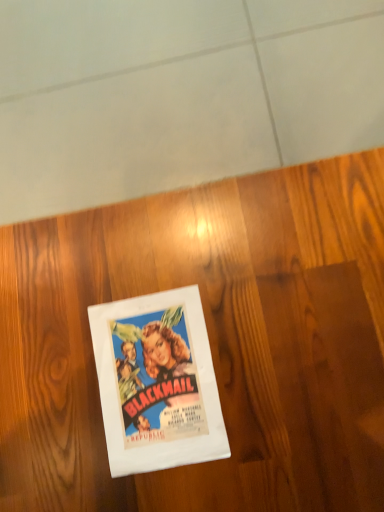
You are a GUI agent. You are given a task and a screenshot of the screen. Output one action in this format:
    pyautogui.click(x=<x>, y=<y>)
    Task: Click on the free point behind white paper at center
    This screenshot has height=512, width=384.
    Given the screenshot: What is the action you would take?
    pyautogui.click(x=98, y=267)